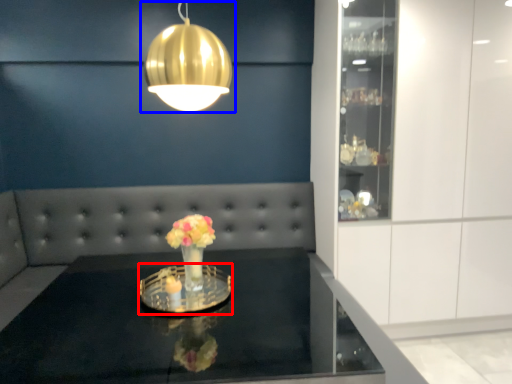
Question: Which of the following is the farthest to the observer, glass plate (highlighted by a red box) or lamp (highlighted by a blue box)?

Choices:
 (A) glass plate
 (B) lamp

Answer: (A)